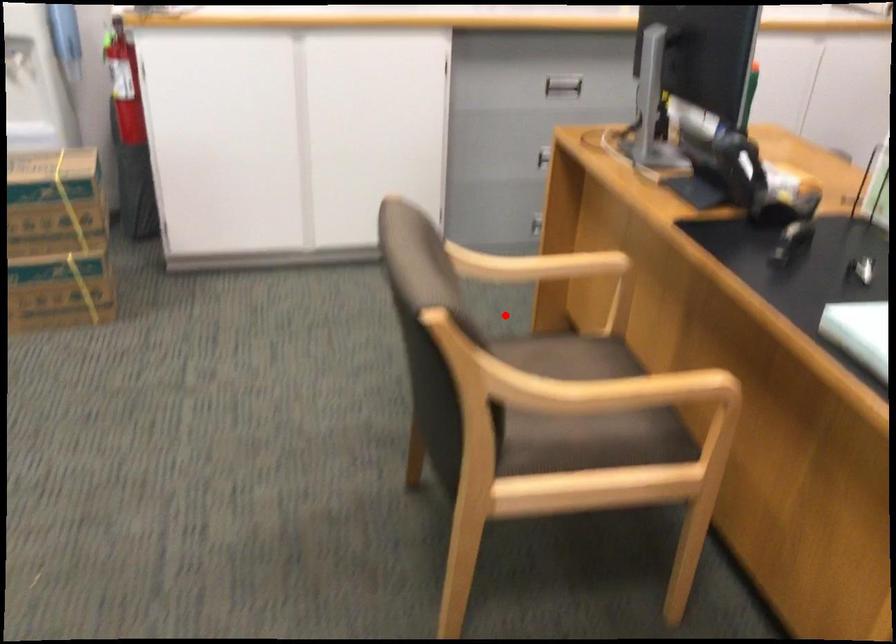
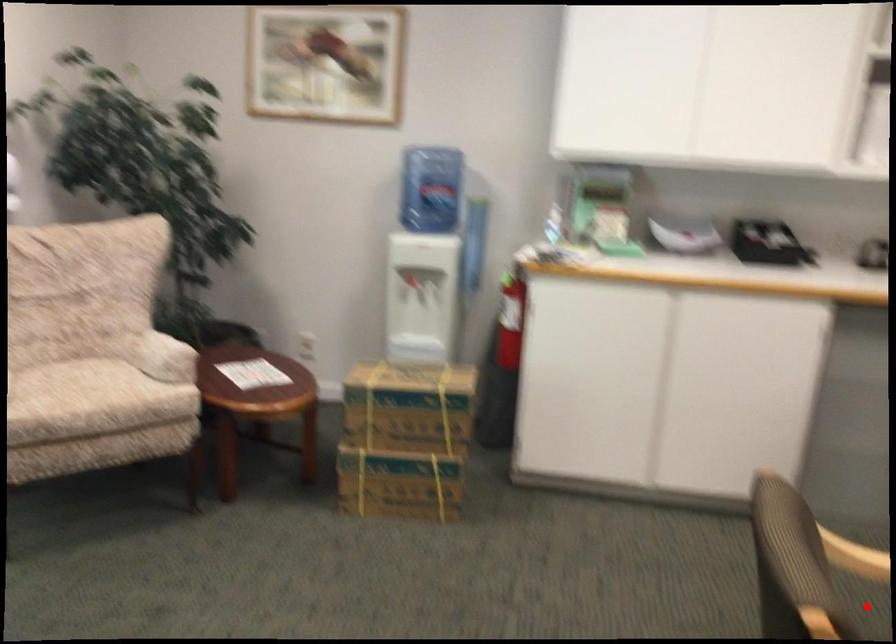
I am providing you with two images of the same scene from different viewpoints. A red point is marked on the first image and another point is marked on the second image. Is the marked point in image1 the same physical position as the marked point in image2?

Yes